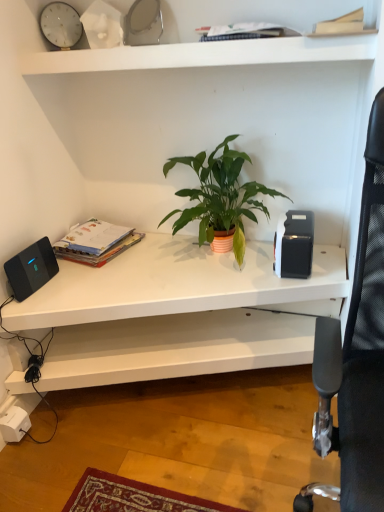
This screenshot has width=384, height=512. In order to click on vacant space in front of black matte speaker at left in this screenshot , I will do `click(33, 300)`.